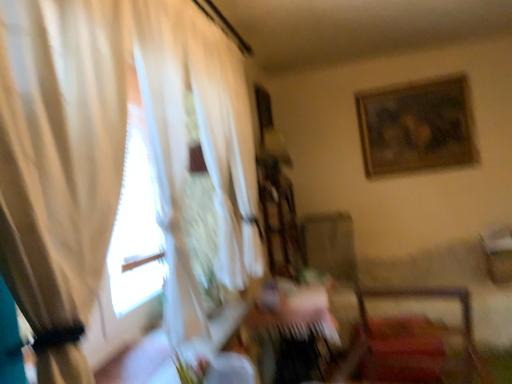
Question: Is wooden table at center taller or shorter than wooden framed artwork at upper right?

Choices:
 (A) tall
 (B) short

Answer: (B)

Question: Based on their sizes in the image, would you say wooden table at center is bigger or smaller than wooden framed artwork at upper right?

Choices:
 (A) big
 (B) small

Answer: (A)

Question: Which is farther from the wooden table at center?

Choices:
 (A) wooden framed artwork at upper right
 (B) velvet red chair at lower right
 (C) white sheer curtain at left

Answer: (A)

Question: Which object is the closest to the wooden table at center?

Choices:
 (A) velvet red chair at lower right
 (B) white sheer curtain at left
 (C) wooden framed artwork at upper right

Answer: (A)